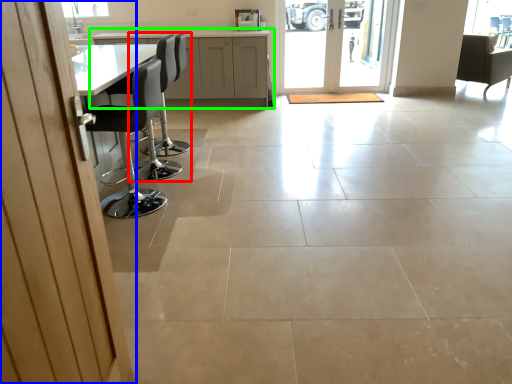
Question: Based on their relative distances, which object is nearer to chair (highlighted by a red box)? Choose from door (highlighted by a blue box) and cabinetry (highlighted by a green box).

Choices:
 (A) door
 (B) cabinetry

Answer: (B)